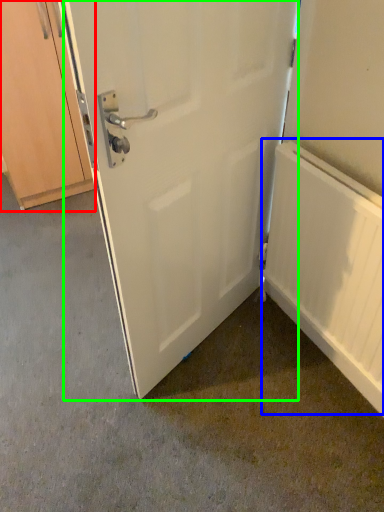
Question: Based on their relative distances, which object is farther from cabinetry (highlighted by a red box)? Choose from radiator (highlighted by a blue box) and door (highlighted by a green box).

Choices:
 (A) radiator
 (B) door

Answer: (A)